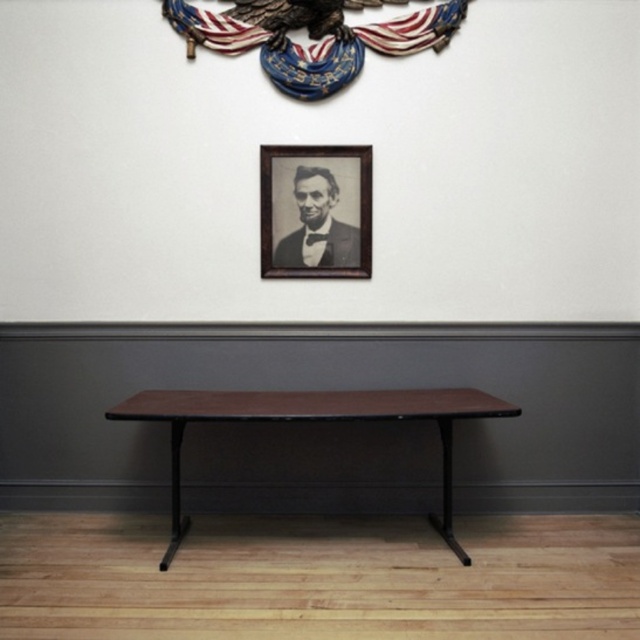
Question: Which object appears closest to the camera in this image?

Choices:
 (A) black wood picture frame at upper center
 (B) brown laminate table at center

Answer: (B)

Question: Is brown laminate table at center in front of black wood picture frame at upper center?

Choices:
 (A) no
 (B) yes

Answer: (B)

Question: Can you confirm if brown laminate table at center is thinner than black wood picture frame at upper center?

Choices:
 (A) yes
 (B) no

Answer: (B)

Question: In this image, where is brown laminate table at center located relative to black wood picture frame at upper center?

Choices:
 (A) above
 (B) below

Answer: (B)

Question: Which point is farther to the camera?

Choices:
 (A) brown laminate table at center
 (B) black wood picture frame at upper center

Answer: (B)